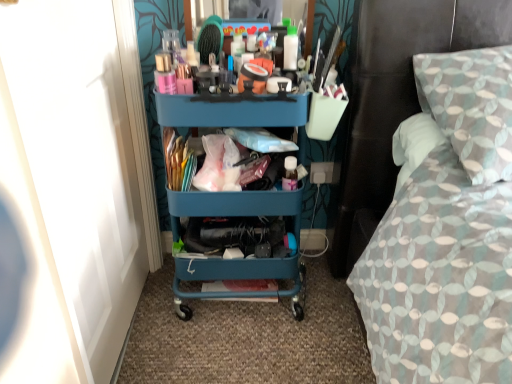
The width and height of the screenshot is (512, 384). Identify the location of free location to the right of teal plastic cart at center. (324, 304).